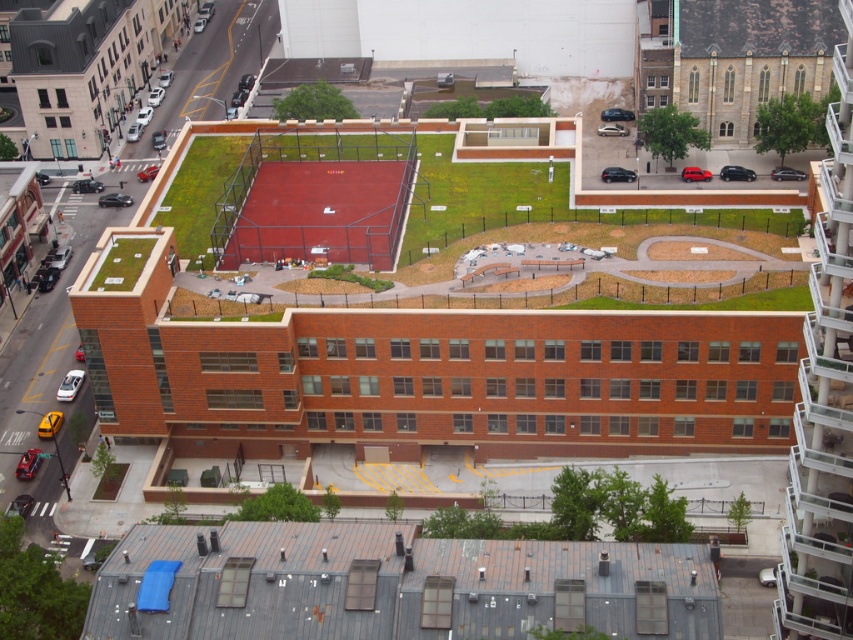
Question: From the image, what is the correct spatial relationship of gray metal roof at lower center in relation to green grass at center?

Choices:
 (A) below
 (B) above

Answer: (A)

Question: Which point appears closest to the camera in this image?

Choices:
 (A) (379, 621)
 (B) (450, 141)

Answer: (A)

Question: Which of the following is the closest to the observer?

Choices:
 (A) (460, 228)
 (B) (677, 604)

Answer: (B)

Question: Which point is closer to the camera taking this photo?

Choices:
 (A) (584, 618)
 (B) (422, 136)

Answer: (A)

Question: Can you confirm if gray metal roof at lower center is positioned above green grass at center?

Choices:
 (A) no
 (B) yes

Answer: (A)

Question: Is gray metal roof at lower center closer to camera compared to green grass at center?

Choices:
 (A) no
 (B) yes

Answer: (B)